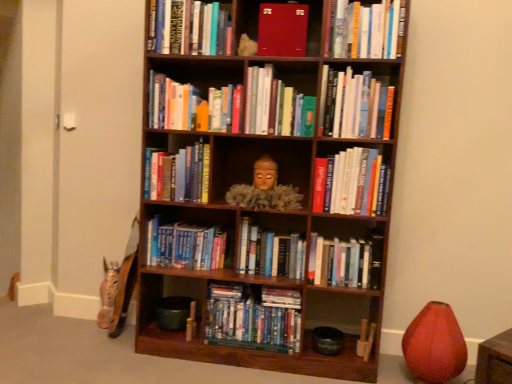
Question: Is matte red book at upper center, the second book from the top, touching hardcover book at upper center, positioned as the fourth book in top-to-bottom order?

Choices:
 (A) yes
 (B) no

Answer: (B)

Question: Considering the relative sizes of matte red book at upper center, the second book from the top, and hardcover book at upper center, positioned as the fourth book in top-to-bottom order, in the image provided, is matte red book at upper center, the second book from the top, smaller than hardcover book at upper center, positioned as the fourth book in top-to-bottom order,?

Choices:
 (A) yes
 (B) no

Answer: (A)

Question: From the image's perspective, is matte red book at upper center, which is the eleventh book in bottom-to-top order, on top of hardcover book at upper center, positioned as the fourth book in top-to-bottom order?

Choices:
 (A) yes
 (B) no

Answer: (A)

Question: Considering the relative positions of matte red book at upper center, which is the eleventh book in bottom-to-top order, and hardcover book at upper center, positioned as the fourth book in top-to-bottom order, in the image provided, is matte red book at upper center, which is the eleventh book in bottom-to-top order, to the left of hardcover book at upper center, positioned as the fourth book in top-to-bottom order, from the viewer's perspective?

Choices:
 (A) yes
 (B) no

Answer: (B)

Question: Considering the relative sizes of matte red book at upper center, which is the eleventh book in bottom-to-top order, and hardcover book at upper center, the 9th book in the bottom-to-top sequence, in the image provided, is matte red book at upper center, which is the eleventh book in bottom-to-top order, thinner than hardcover book at upper center, the 9th book in the bottom-to-top sequence,?

Choices:
 (A) no
 (B) yes

Answer: (A)

Question: Relative to blue hardcover books at center, the ninth book viewed from the top, is hardcover books at upper center, which is counted as the 12th book, starting from the bottom, in front or behind?

Choices:
 (A) front
 (B) behind

Answer: (A)

Question: In the image, is hardcover books at upper center, which is counted as the 12th book, starting from the bottom, on the left side or the right side of blue hardcover books at center, the ninth book viewed from the top?

Choices:
 (A) right
 (B) left

Answer: (A)

Question: From a real-world perspective, is hardcover books at upper center, the first book positioned from the top, physically located above or below blue hardcover books at center, the ninth book viewed from the top?

Choices:
 (A) below
 (B) above

Answer: (B)

Question: From the image's perspective, is hardcover books at upper center, the first book positioned from the top, located above or below blue hardcover books at center, the ninth book viewed from the top?

Choices:
 (A) above
 (B) below

Answer: (A)

Question: Considering their positions, is hardcover books at upper center, which is counted as the 12th book, starting from the bottom, located in front of or behind hardcover books at upper center, the third book when ordered from top to bottom?

Choices:
 (A) front
 (B) behind

Answer: (B)

Question: From a real-world perspective, is hardcover books at upper center, the first book positioned from the top, physically located above or below hardcover books at upper center, the third book when ordered from top to bottom?

Choices:
 (A) above
 (B) below

Answer: (B)

Question: Looking at the image, does hardcover books at upper center, which is counted as the 12th book, starting from the bottom, seem bigger or smaller compared to hardcover books at upper center, the 10th book positioned from the bottom?

Choices:
 (A) small
 (B) big

Answer: (A)

Question: Is point (152, 8) positioned closer to the camera than point (356, 51)?

Choices:
 (A) farther
 (B) closer

Answer: (A)

Question: Considering the positions of blue hardcover books at center, positioned as the first book in bottom-to-top order, and hardcover books at center, the 3th book in the bottom-to-top sequence, in the image, is blue hardcover books at center, positioned as the first book in bottom-to-top order, wider or thinner than hardcover books at center, the 3th book in the bottom-to-top sequence,?

Choices:
 (A) thin
 (B) wide

Answer: (B)

Question: Would you say blue hardcover books at center, positioned as the first book in bottom-to-top order, is inside or outside hardcover books at center, which ranks as the 10th book in top-to-bottom order?

Choices:
 (A) outside
 (B) inside

Answer: (A)